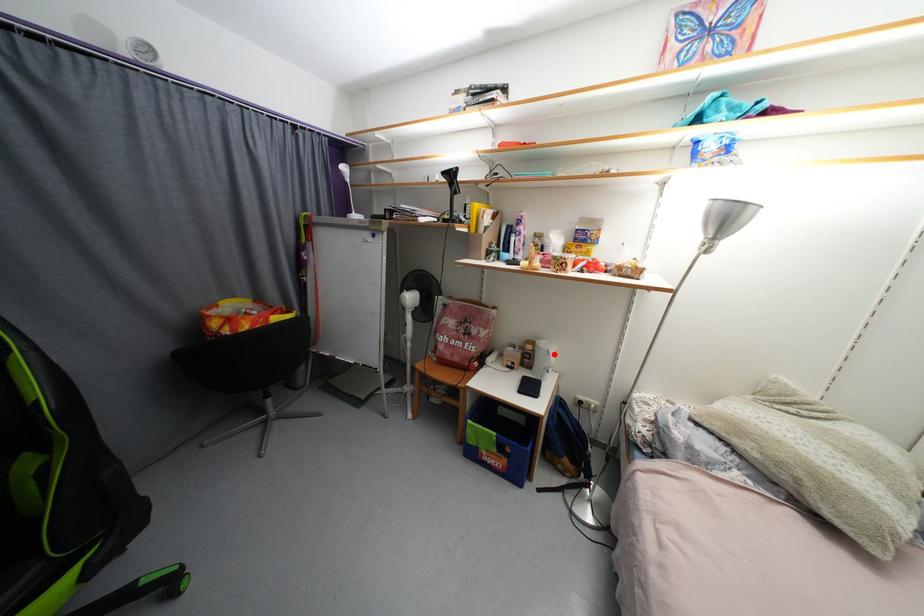
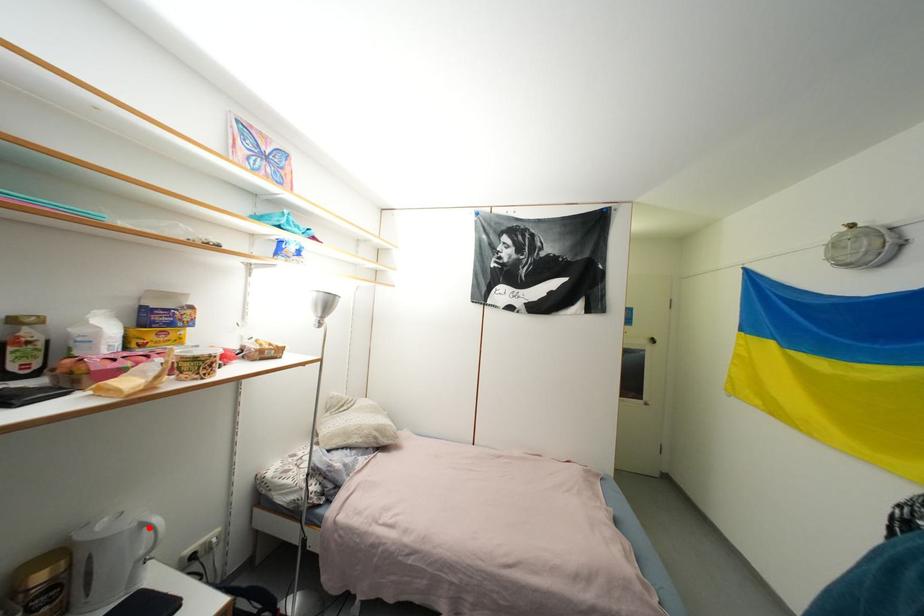
I am providing you with two images of the same scene from different viewpoints. A red point is marked on the first image and another point is marked on the second image. Do the highlighted points in image1 and image2 indicate the same real-world spot?

Yes